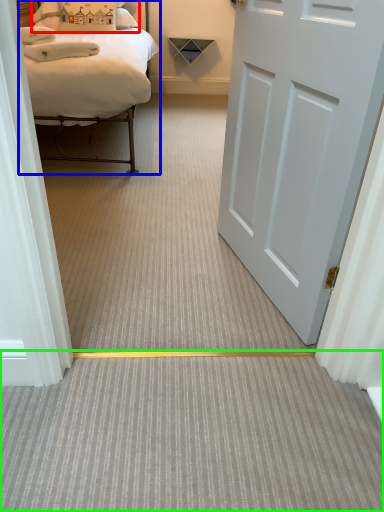
Question: Based on their relative distances, which object is farther from pillow (highlighted by a red box)? Choose from bed (highlighted by a blue box) and plain (highlighted by a green box).

Choices:
 (A) bed
 (B) plain

Answer: (B)